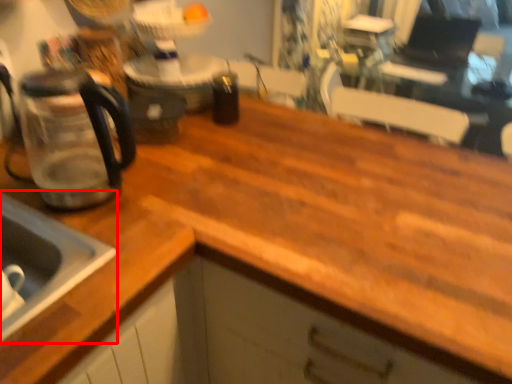
Question: From the image's perspective, considering the relative positions of sink (annotated by the red box) and coffeepot in the image provided, where is sink (annotated by the red box) located with respect to the staircase?

Choices:
 (A) above
 (B) below

Answer: (B)